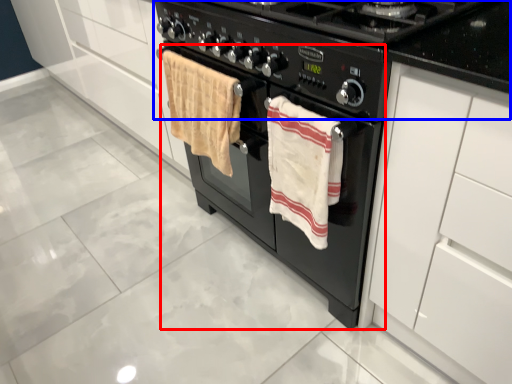
Question: Which object is closer to the camera taking this photo, oven (highlighted by a red box) or gas stove (highlighted by a blue box)?

Choices:
 (A) oven
 (B) gas stove

Answer: (B)